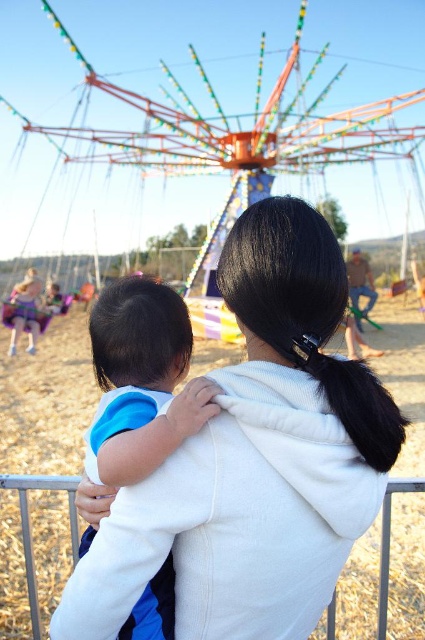
Which is below, white fleece jacket at center or blue cotton shirt at center?

blue cotton shirt at center is lower down.

Is point (74, 570) behind point (121, 636)?

No, (74, 570) is in front of (121, 636).

Who is more distant from viewer, (283, 221) or (180, 337)?

Point (180, 337)

The image size is (425, 640). I want to click on white fleece jacket at center, so point(255,460).

Does blue cotton shirt at center appear over white fabric at center?

Yes.

Is blue cotton shirt at center bigger than white fabric at center?

Incorrect, blue cotton shirt at center is not larger than white fabric at center.

Between point (155, 419) and point (36, 614), which one is positioned behind?

Point (36, 614)

Where is `blue cotton shirt at center`? blue cotton shirt at center is located at coordinates (141, 381).

Can you confirm if multicolored plastic carousel at center is bigger than white fabric at center?

Indeed, multicolored plastic carousel at center has a larger size compared to white fabric at center.

Identify the location of multicolored plastic carousel at center. (232, 145).

The height and width of the screenshot is (640, 425). What do you see at coordinates (232, 145) in the screenshot?
I see `multicolored plastic carousel at center` at bounding box center [232, 145].

Locate an element on the screen. The height and width of the screenshot is (640, 425). multicolored plastic carousel at center is located at coordinates (232, 145).